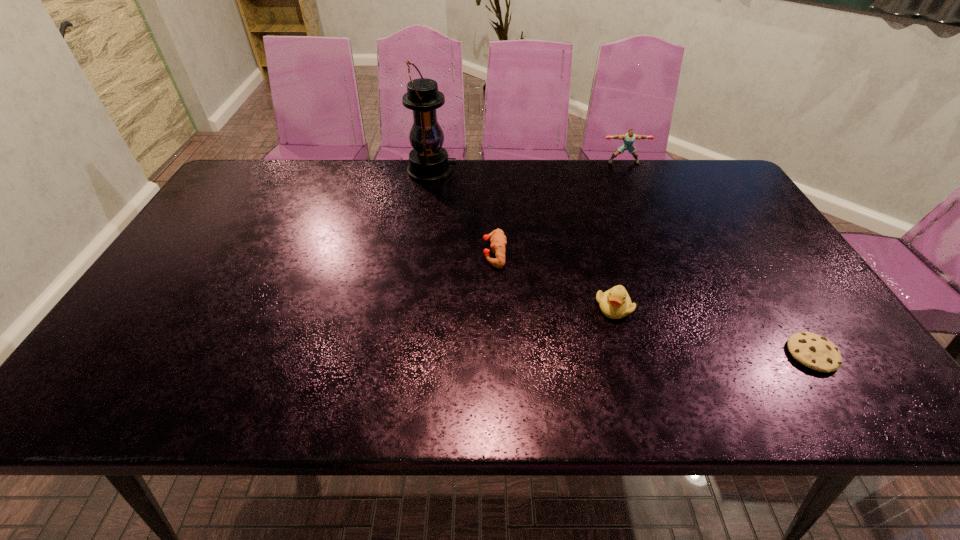
Locate an element on the screen. free space in the image that satisfies the following two spatial constraints: 1. with the gloves of the shortest object facing forward; 2. on the left side of the second object from left to right is located at coordinates click(498, 354).

Where is `free region that satisfies the following two spatial constraints: 1. on the beak of the third object from left to right; 2. on the right side of the shortest object`? free region that satisfies the following two spatial constraints: 1. on the beak of the third object from left to right; 2. on the right side of the shortest object is located at coordinates 627,354.

Where is `free space that satisfies the following two spatial constraints: 1. on the front-facing side of the second object from right to left; 2. on the left side of the shortest object`? free space that satisfies the following two spatial constraints: 1. on the front-facing side of the second object from right to left; 2. on the left side of the shortest object is located at coordinates (708, 354).

Where is `vacant space that satisfies the following two spatial constraints: 1. on the front-facing side of the second object from right to left; 2. with the gloves of the shorter puncher facing forward`? vacant space that satisfies the following two spatial constraints: 1. on the front-facing side of the second object from right to left; 2. with the gloves of the shorter puncher facing forward is located at coordinates (663, 253).

What are the coordinates of `blank space that satisfies the following two spatial constraints: 1. on the front-facing side of the fourth object from left to right; 2. above the tallest object, indicating its light source` in the screenshot? It's located at (628, 171).

Locate an element on the screen. This screenshot has width=960, height=540. vacant space that satisfies the following two spatial constraints: 1. on the front-facing side of the farther puncher; 2. on the left side of the shortest object is located at coordinates (708, 354).

Where is `free space in the image that satisfies the following two spatial constraints: 1. on the front-facing side of the second tallest object; 2. with the gloves of the second object from left to right facing forward`? This screenshot has height=540, width=960. free space in the image that satisfies the following two spatial constraints: 1. on the front-facing side of the second tallest object; 2. with the gloves of the second object from left to right facing forward is located at coordinates (663, 253).

Identify the location of vacant area that satisfies the following two spatial constraints: 1. on the beak of the third shortest object; 2. on the left side of the cookie. This screenshot has height=540, width=960. (627, 354).

The image size is (960, 540). Identify the location of free space that satisfies the following two spatial constraints: 1. with the gloves of the third farthest object facing forward; 2. on the right side of the rightmost object. (498, 354).

You are a GUI agent. You are given a task and a screenshot of the screen. Output one action in this format:
    pyautogui.click(x=<x>, y=<y>)
    Task: Click on the blank area in the image that satisfies the following two spatial constraints: 1. on the beak of the third shortest object; 2. on the right side of the nearest object
    The width and height of the screenshot is (960, 540).
    Given the screenshot: What is the action you would take?
    pyautogui.click(x=627, y=354)